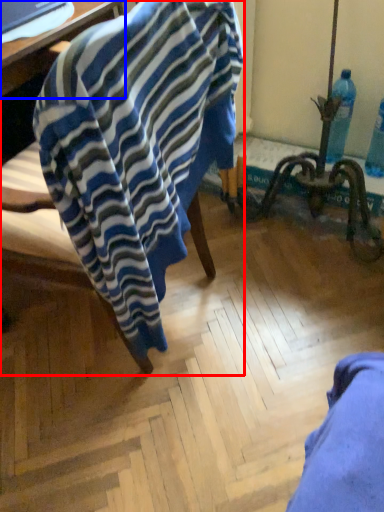
Question: Which object is closer to the camera taking this photo, chair (highlighted by a red box) or table (highlighted by a blue box)?

Choices:
 (A) chair
 (B) table

Answer: (A)